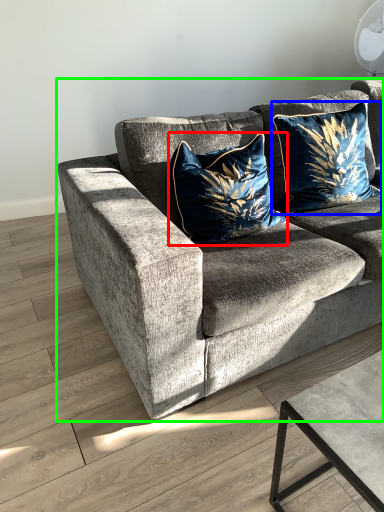
Question: Considering the real-world distances, which object is closest to pillow (highlighted by a red box)? pillow (highlighted by a blue box) or studio couch (highlighted by a green box).

Choices:
 (A) pillow
 (B) studio couch

Answer: (B)